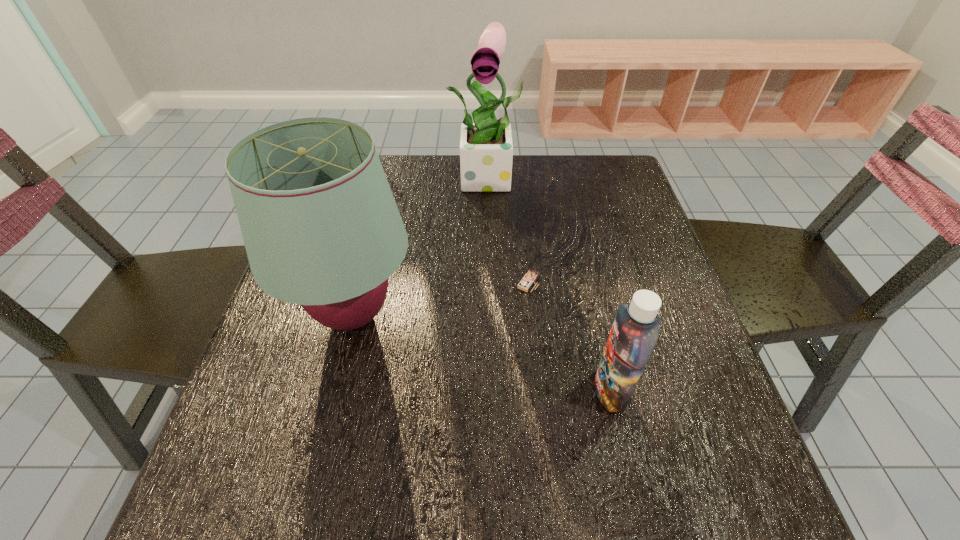
Where is `the farthest object`? Image resolution: width=960 pixels, height=540 pixels. the farthest object is located at coordinates (486, 149).

This screenshot has width=960, height=540. I want to click on lampshade, so click(x=321, y=228).

Locate an element on the screen. The height and width of the screenshot is (540, 960). shampoo is located at coordinates (636, 327).

Where is `the third tallest object`? the third tallest object is located at coordinates (636, 327).

Where is `matchbox`? This screenshot has width=960, height=540. matchbox is located at coordinates (528, 280).

Where is `vacant area located 0.250m on the front-facing side of the farthest object`? The width and height of the screenshot is (960, 540). vacant area located 0.250m on the front-facing side of the farthest object is located at coordinates (493, 263).

At what (x,y) coordinates should I click in order to perform the action: click on free space located 0.170m on the back of the lampshade. Please return your answer as a coordinate pair (x, y). The height and width of the screenshot is (540, 960). Looking at the image, I should click on (376, 222).

At what (x,y) coordinates should I click in order to perform the action: click on vacant space situated on the front label of the rightmost object. Please return your answer as a coordinate pair (x, y). Image resolution: width=960 pixels, height=540 pixels. Looking at the image, I should click on (523, 390).

In order to click on free space located on the front label of the rightmost object in this screenshot , I will do `click(445, 390)`.

Where is `vacant space located on the front label of the rightmost object`? vacant space located on the front label of the rightmost object is located at coordinates (556, 390).